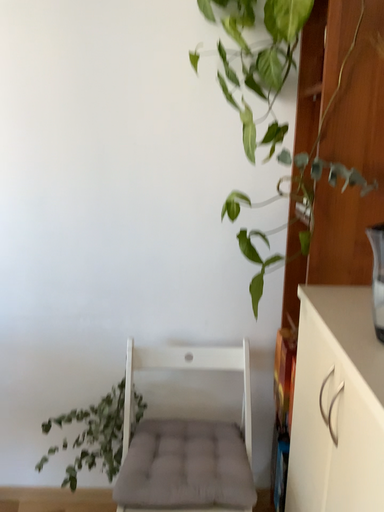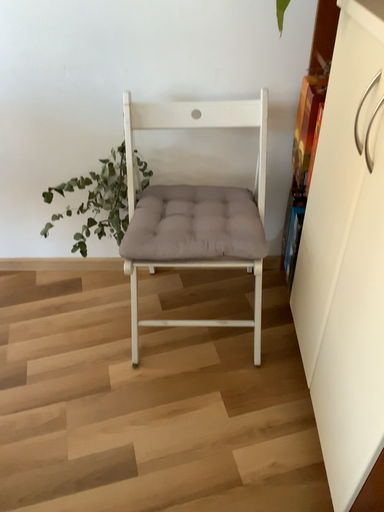
Question: How did the camera likely rotate when shooting the video?

Choices:
 (A) rotated downward
 (B) rotated upward

Answer: (A)